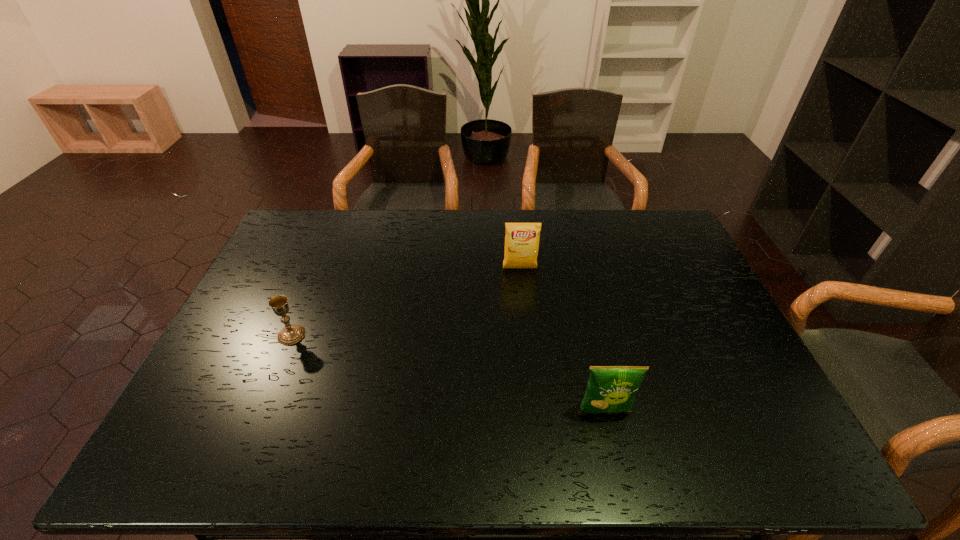
The image size is (960, 540). What are the coordinates of `vacant space at the far edge of the desktop` in the screenshot? It's located at (462, 230).

In order to click on free space at the near edge in this screenshot , I will do `click(338, 461)`.

In the image, there is a desktop. At what (x,y) coordinates should I click in order to perform the action: click on free space at the left edge. Please return your answer as a coordinate pair (x, y). Looking at the image, I should click on (239, 416).

You are a GUI agent. You are given a task and a screenshot of the screen. Output one action in this format:
    pyautogui.click(x=<x>, y=<y>)
    Task: Click on the vacant space at the right edge
    
    Given the screenshot: What is the action you would take?
    pyautogui.click(x=666, y=267)

This screenshot has width=960, height=540. In order to click on vacant space at the near left corner of the desktop in this screenshot , I will do `click(213, 468)`.

In the image, there is a desktop. Identify the location of free space at the far right corner. (679, 233).

At what (x,y) coordinates should I click in order to perform the action: click on empty space that is in between the nearer crisp (potato chip) and the second nearest object. Please return your answer as a coordinate pair (x, y). Image resolution: width=960 pixels, height=540 pixels. Looking at the image, I should click on (448, 373).

The width and height of the screenshot is (960, 540). I want to click on vacant space that is in between the leftmost object and the farther crisp (potato chip), so click(406, 302).

Where is `unoccupied position between the nearer crisp (potato chip) and the farthest object`? Image resolution: width=960 pixels, height=540 pixels. unoccupied position between the nearer crisp (potato chip) and the farthest object is located at coordinates (562, 340).

Where is `free space that is in between the nearer crisp (potato chip) and the second nearest object`? This screenshot has width=960, height=540. free space that is in between the nearer crisp (potato chip) and the second nearest object is located at coordinates (448, 373).